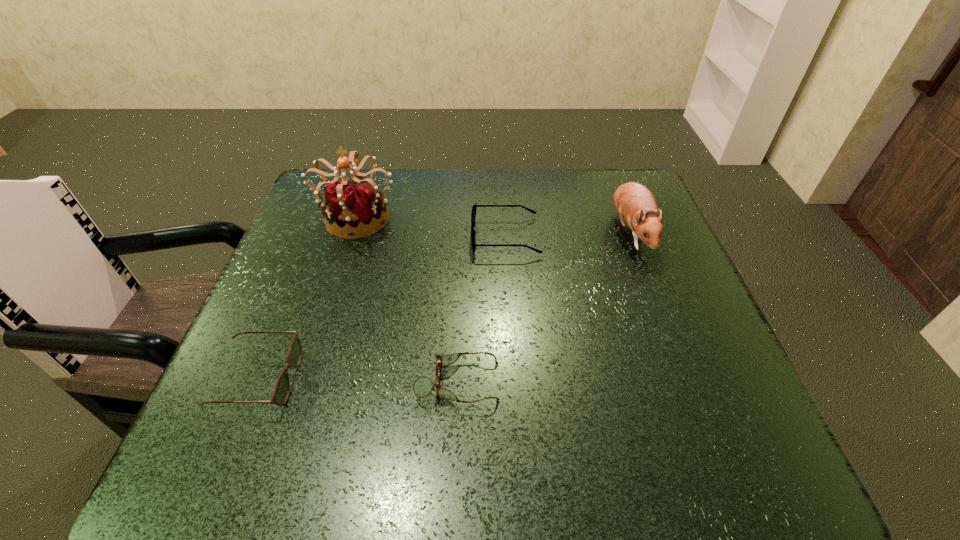
Locate an element on the screen. The height and width of the screenshot is (540, 960). vacant position located on the front-facing side of the farthest spectacles is located at coordinates (361, 237).

Find the location of a particular element. The image size is (960, 540). free location located 0.270m at the front view of the leftmost spectacles is located at coordinates (444, 379).

Locate an element on the screen. The height and width of the screenshot is (540, 960). blank space located 0.060m on the front-facing side of the shortest spectacles is located at coordinates (533, 382).

This screenshot has width=960, height=540. Find the location of `tiara located in the far edge section of the desktop`. tiara located in the far edge section of the desktop is located at coordinates (356, 205).

The height and width of the screenshot is (540, 960). In order to click on hamster that is at the far edge in this screenshot , I will do `click(635, 204)`.

What are the coordinates of `spectacles present at the far edge` in the screenshot? It's located at (473, 215).

Where is `tiara situated at the left edge`? This screenshot has width=960, height=540. tiara situated at the left edge is located at coordinates (356, 205).

Where is `spectacles at the left edge`? This screenshot has height=540, width=960. spectacles at the left edge is located at coordinates (280, 393).

Find the location of a particular element. This screenshot has width=960, height=540. object at the right edge is located at coordinates (635, 204).

The height and width of the screenshot is (540, 960). I want to click on object situated at the far left corner, so click(x=356, y=205).